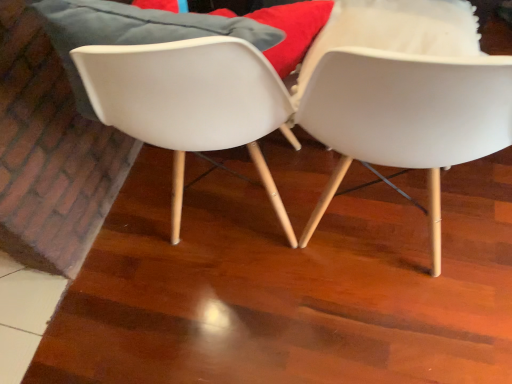
Question: From a real-world perspective, does white matte chair at center, which is counted as the 1th chair, starting from the right, stand above white plastic chair at center, which ranks as the 2th chair in right-to-left order?

Choices:
 (A) yes
 (B) no

Answer: (A)

Question: Is white matte chair at center, which is counted as the 1th chair, starting from the right, not within white plastic chair at center, which ranks as the 2th chair in right-to-left order?

Choices:
 (A) yes
 (B) no

Answer: (A)

Question: Is the depth of white matte chair at center, positioned as the 2th chair in left-to-right order, less than that of white plastic chair at center, which ranks as the 2th chair in right-to-left order?

Choices:
 (A) yes
 (B) no

Answer: (A)

Question: Considering the relative sizes of white matte chair at center, positioned as the 2th chair in left-to-right order, and white plastic chair at center, which ranks as the 2th chair in right-to-left order, in the image provided, is white matte chair at center, positioned as the 2th chair in left-to-right order, bigger than white plastic chair at center, which ranks as the 2th chair in right-to-left order,?

Choices:
 (A) no
 (B) yes

Answer: (B)

Question: Is white matte chair at center, positioned as the 2th chair in left-to-right order, positioned far away from white plastic chair at center, the first chair viewed from the left?

Choices:
 (A) yes
 (B) no

Answer: (B)

Question: Is white matte chair at center, positioned as the 2th chair in left-to-right order, wider than white plastic chair at center, which ranks as the 2th chair in right-to-left order?

Choices:
 (A) no
 (B) yes

Answer: (A)

Question: Considering the relative sizes of white plastic chair at center, the first chair viewed from the left, and white matte chair at center, which is counted as the 1th chair, starting from the right, in the image provided, is white plastic chair at center, the first chair viewed from the left, wider than white matte chair at center, which is counted as the 1th chair, starting from the right,?

Choices:
 (A) yes
 (B) no

Answer: (A)

Question: Can you confirm if white plastic chair at center, which ranks as the 2th chair in right-to-left order, is positioned to the left of white matte chair at center, positioned as the 2th chair in left-to-right order?

Choices:
 (A) no
 (B) yes

Answer: (B)

Question: Does white plastic chair at center, which ranks as the 2th chair in right-to-left order, have a larger size compared to white matte chair at center, which is counted as the 1th chair, starting from the right?

Choices:
 (A) yes
 (B) no

Answer: (B)

Question: Is white plastic chair at center, the first chair viewed from the left, shorter than white matte chair at center, positioned as the 2th chair in left-to-right order?

Choices:
 (A) yes
 (B) no

Answer: (A)

Question: Is white plastic chair at center, the first chair viewed from the left, at the right side of white matte chair at center, which is counted as the 1th chair, starting from the right?

Choices:
 (A) yes
 (B) no

Answer: (B)

Question: Is white plastic chair at center, which ranks as the 2th chair in right-to-left order, positioned before white matte chair at center, which is counted as the 1th chair, starting from the right?

Choices:
 (A) no
 (B) yes

Answer: (A)

Question: In terms of size, does white plastic chair at center, the first chair viewed from the left, appear bigger or smaller than white matte chair at center, positioned as the 2th chair in left-to-right order?

Choices:
 (A) big
 (B) small

Answer: (B)